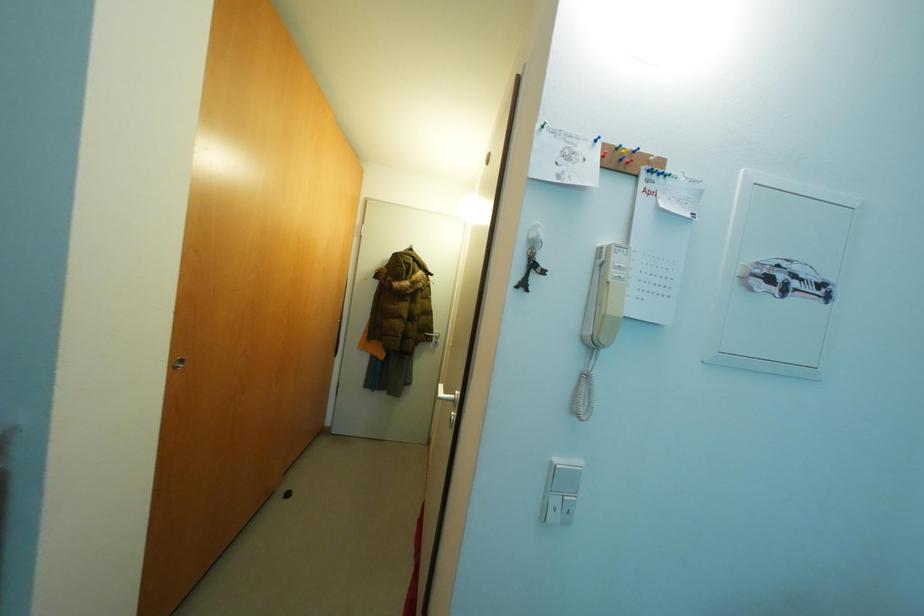
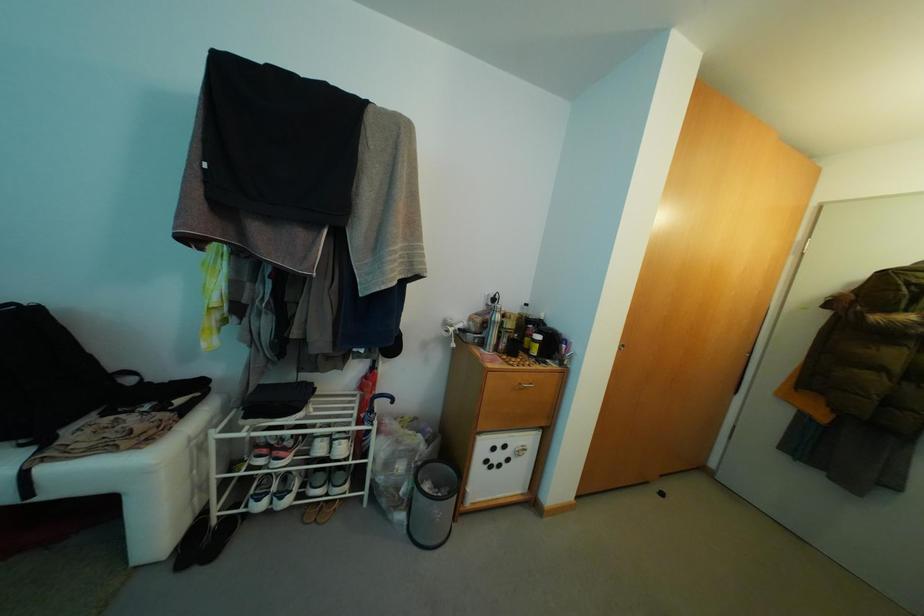
Question: The first image is from the beginning of the video and the second image is from the end. How did the camera likely rotate when shooting the video?

Choices:
 (A) Left
 (B) Right
 (C) Up
 (D) Down

Answer: (A)